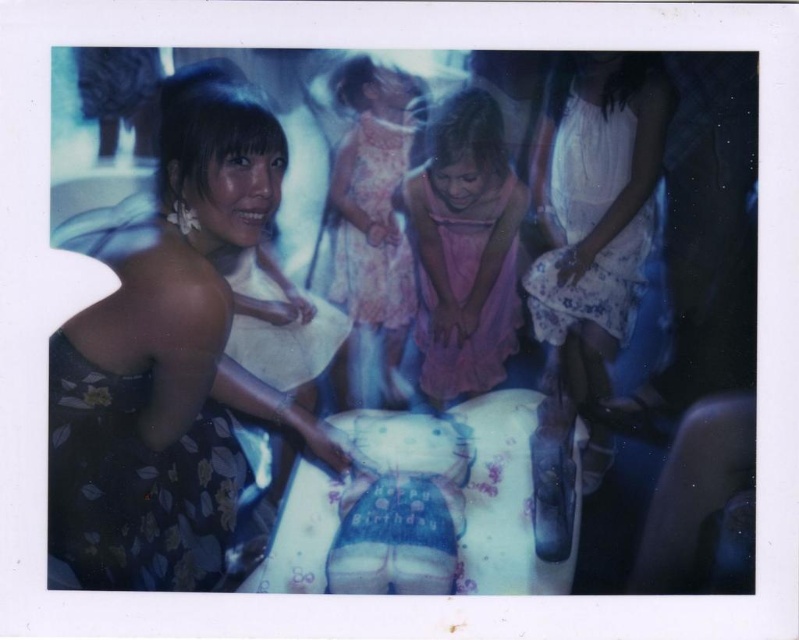
Question: Observing the image, what is the correct spatial positioning of floral dress at left in reference to pink floral dress at center?

Choices:
 (A) below
 (B) above

Answer: (A)

Question: Which object is farther from the camera taking this photo?

Choices:
 (A) pink floral dress at center
 (B) pink satin dress at center

Answer: (B)

Question: Which object appears farthest from the camera in this image?

Choices:
 (A) pink satin dress at center
 (B) pink floral dress at center
 (C) floral dress at left

Answer: (A)

Question: Which object is closer to the camera taking this photo?

Choices:
 (A) pink satin dress at center
 (B) pink floral dress at center
 (C) floral dress at left

Answer: (C)

Question: Does floral dress at left appear under pink satin dress at center?

Choices:
 (A) no
 (B) yes

Answer: (B)

Question: Can you confirm if pink satin dress at center is positioned to the left of pink floral dress at center?

Choices:
 (A) yes
 (B) no

Answer: (B)